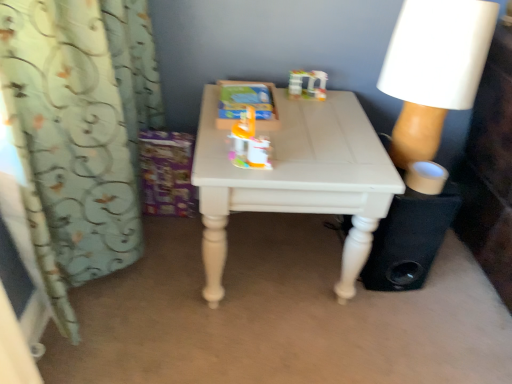
In order to click on vacant space in front of white painted wood table at center in this screenshot , I will do `click(265, 352)`.